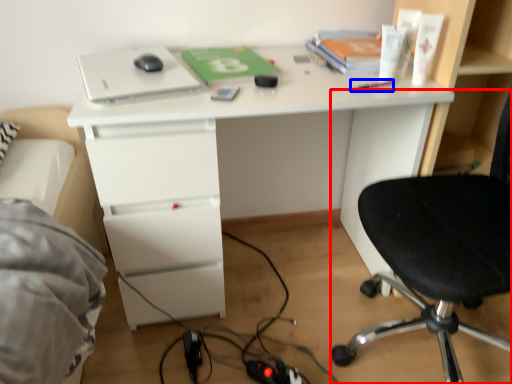
Question: Which point is further to the camera, chair (highlighted by a red box) or stationery (highlighted by a blue box)?

Choices:
 (A) chair
 (B) stationery

Answer: (B)